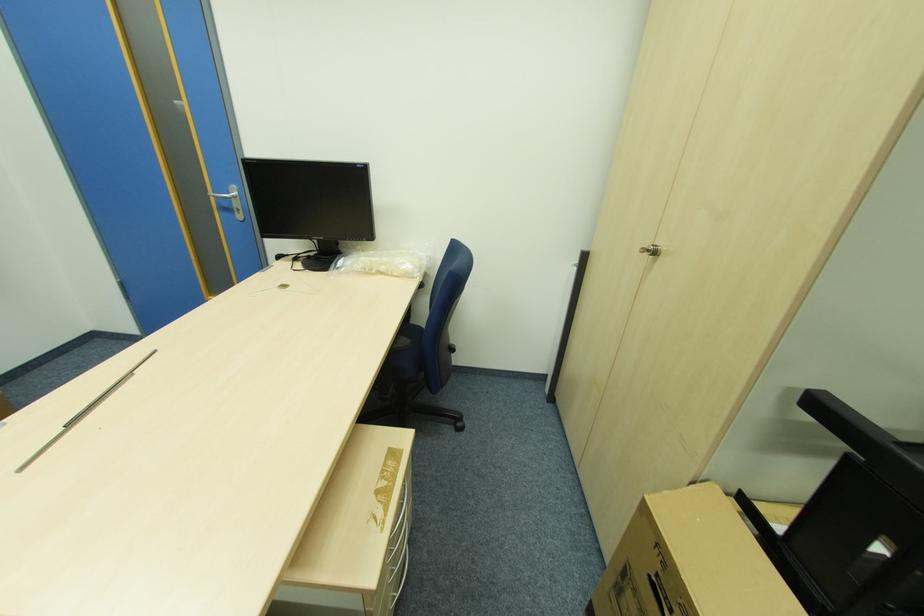
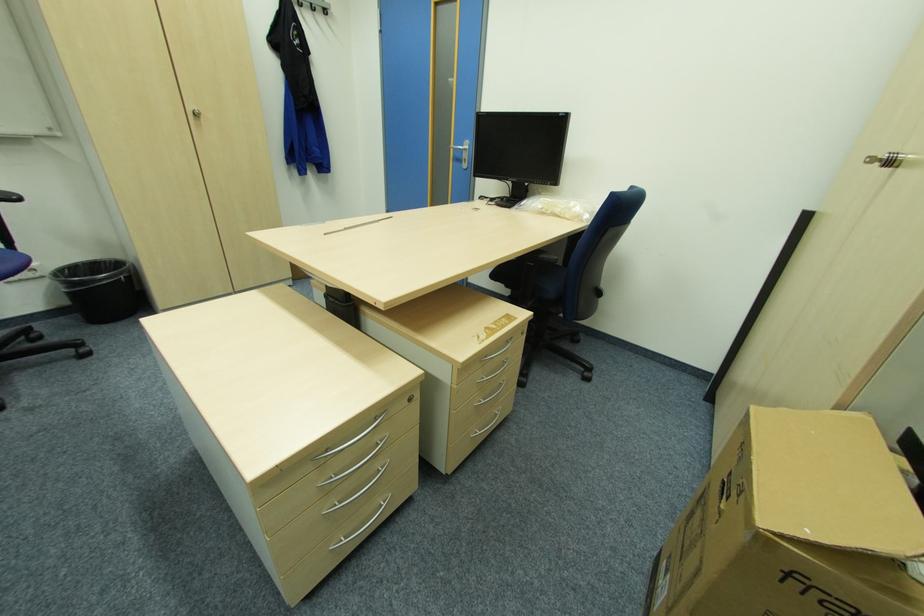
Find the pixel in the second image that matches the point at 237,197 in the first image.

(468, 148)